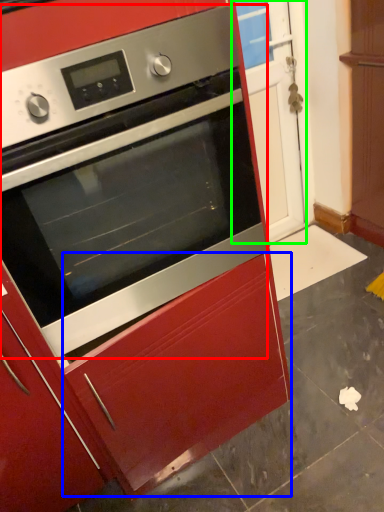
Question: Estimate the real-world distances between objects in this image. Which object is closer to oven (highlighted by a red box), drawer (highlighted by a blue box) or glass door (highlighted by a green box)?

Choices:
 (A) drawer
 (B) glass door

Answer: (A)